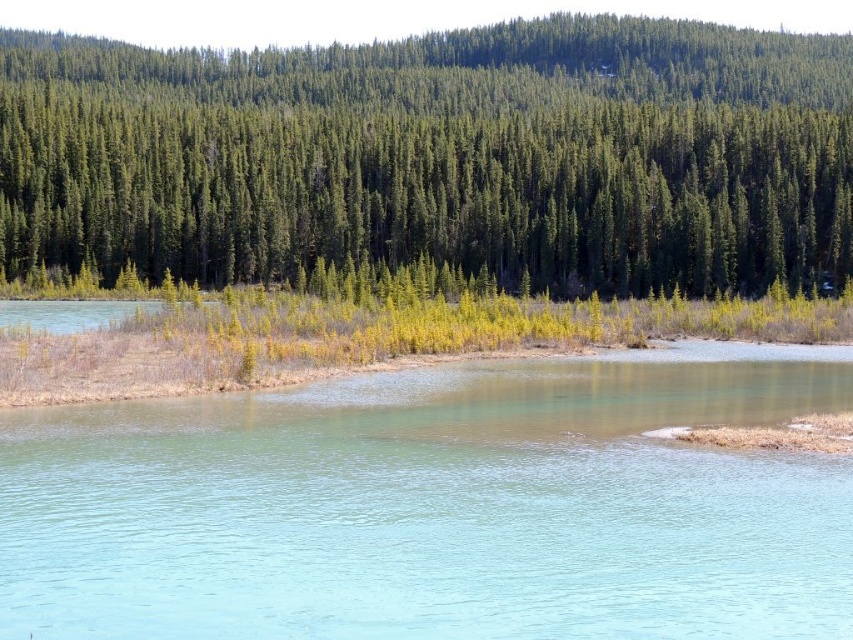
Does point (492, 620) lie behind point (527, 273)?

No, (492, 620) is closer to viewer.

The width and height of the screenshot is (853, 640). I want to click on clear water at center, so click(437, 506).